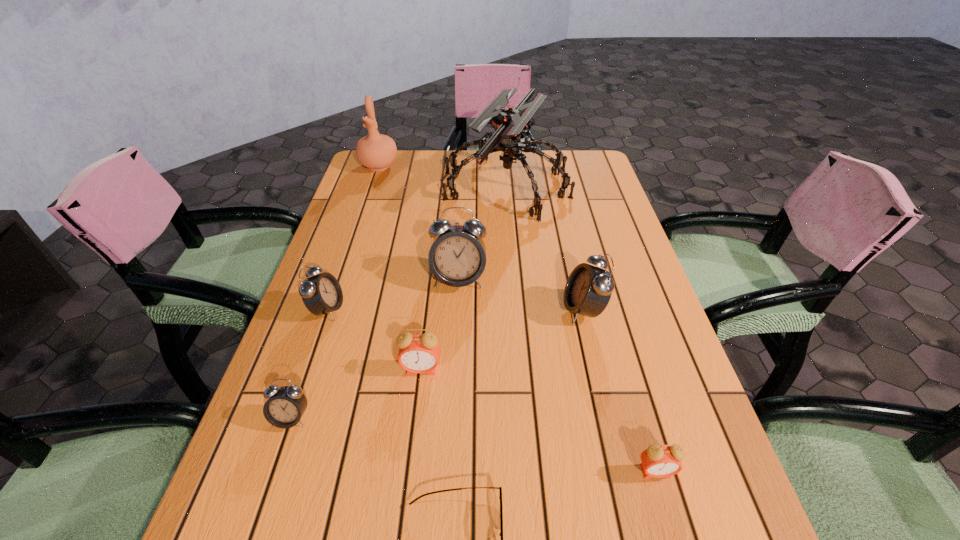
Find the location of `drone`. drone is located at coordinates (509, 123).

Where is `the second tallest object`? The height and width of the screenshot is (540, 960). the second tallest object is located at coordinates (377, 152).

Image resolution: width=960 pixels, height=540 pixels. I want to click on the third white alarm clock from left to right, so tap(457, 257).

Locate an element on the screen. the biggest white alarm clock is located at coordinates (457, 257).

At what (x,y) coordinates should I click in order to perform the action: click on the rightmost white alarm clock. Please return your answer as a coordinate pair (x, y). This screenshot has width=960, height=540. Looking at the image, I should click on (588, 290).

Find the location of `the fifth shortest alarm clock`. the fifth shortest alarm clock is located at coordinates (588, 290).

Where is `the second smallest white alarm clock`? This screenshot has height=540, width=960. the second smallest white alarm clock is located at coordinates (321, 294).

Where is `the bigger pink alarm clock`? The image size is (960, 540). the bigger pink alarm clock is located at coordinates (418, 353).

Locate an element on the screen. the farther pink alarm clock is located at coordinates (418, 353).

Find the location of a particular element. This screenshot has width=960, height=540. the third nearest object is located at coordinates pos(285,406).